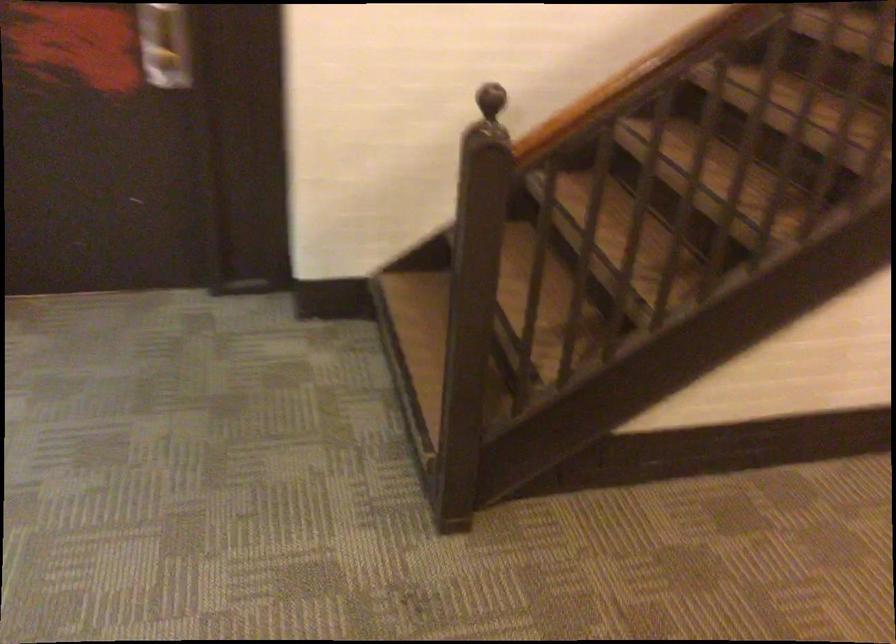
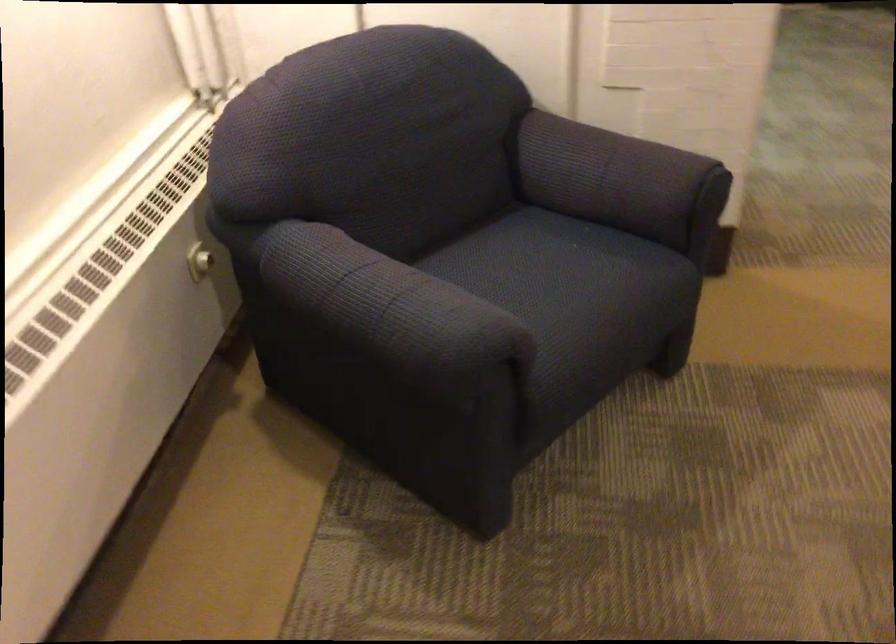
What movement of the cameraman would produce the second image?

The cameraman walked toward left, backward.